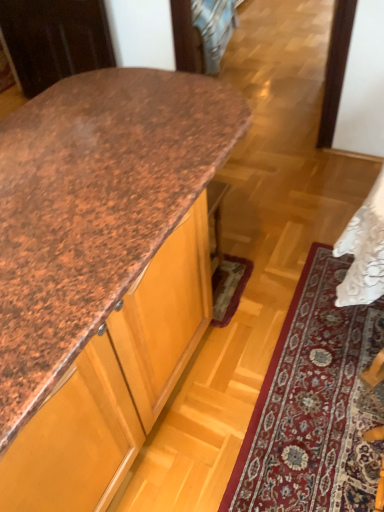
Where is `vacant point to the left of carpet with intricate patterns at lower right`? This screenshot has height=512, width=384. vacant point to the left of carpet with intricate patterns at lower right is located at coordinates (219, 391).